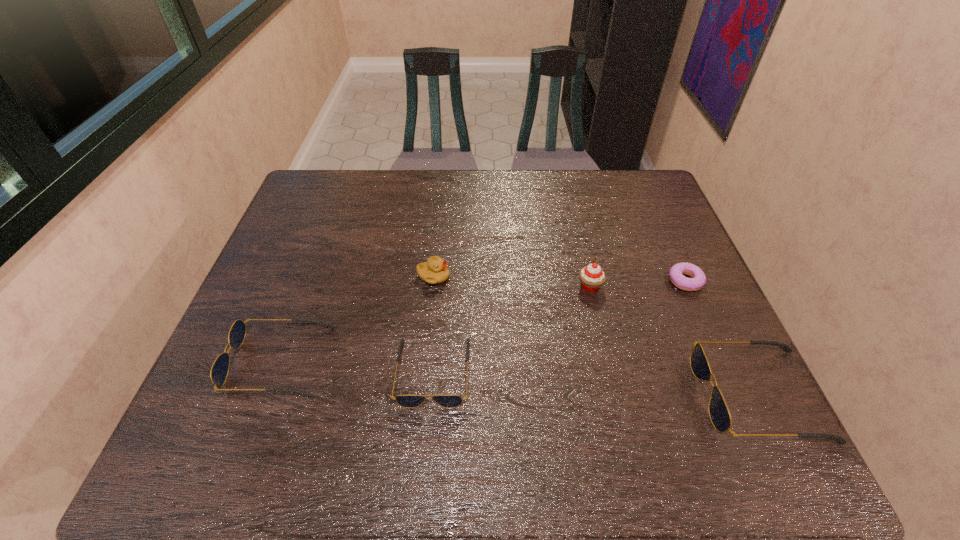
Locate an element on the screen. free point at the far edge is located at coordinates (373, 211).

You are a GUI agent. You are given a task and a screenshot of the screen. Output one action in this format:
    pyautogui.click(x=<x>, y=<y>)
    Task: Click on the free location at the near edge of the desktop
    The image size is (960, 540).
    Given the screenshot: What is the action you would take?
    pyautogui.click(x=565, y=414)

The image size is (960, 540). In the image, there is a desktop. Find the location of `vacant space at the left edge`. vacant space at the left edge is located at coordinates (311, 253).

This screenshot has height=540, width=960. I want to click on blank space at the right edge, so click(636, 257).

The image size is (960, 540). In the image, there is a desktop. What are the coordinates of `free space at the far left corner` in the screenshot? It's located at click(x=356, y=180).

This screenshot has width=960, height=540. In order to click on vacant space at the far right corner in this screenshot , I will do `click(613, 195)`.

Find the location of `free space between the leftmost sunglasses and the doughnut`. free space between the leftmost sunglasses and the doughnut is located at coordinates (483, 321).

Locate an element on the screen. vacant area that lies between the cupcake and the duckling is located at coordinates (512, 281).

Locate an element on the screen. free space that is in between the duckling and the fourth object from left to right is located at coordinates (512, 281).

Identify the location of free space between the rightmost sunglasses and the leftmost object. (519, 378).